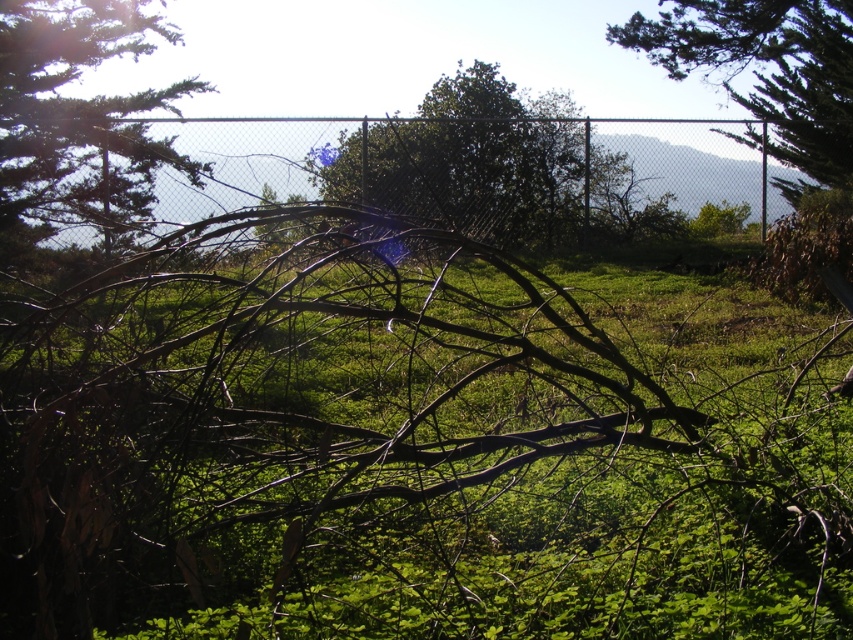
You are standing in the outdoor scene and want to place a small flag at each of the two points labeled point (65,438) and point (784,157). Which point will have its flag closer to your eyes when you look straight ahead?

Point (65,438) is closer to the viewer than point (784,157), so the flag placed at point (65,438) will be closer to your eyes when looking straight ahead.

You are standing in the outdoor scene and want to place a small flag at the point closer to you between the two points marked as point (202, 129) and point (32, 212). Which point should you choose?

You should choose point (202, 129) because it is closer to you than point (32, 212).